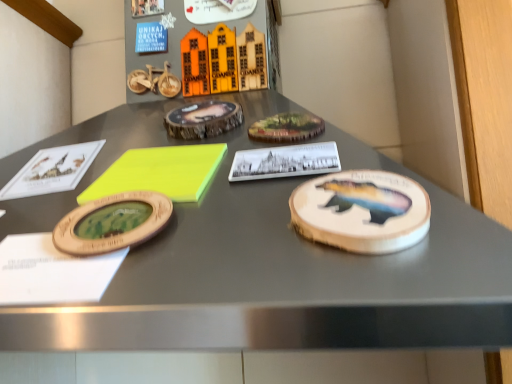
Question: Considering the positions of point (310, 180) and point (111, 168), is point (310, 180) closer or farther from the camera than point (111, 168)?

Choices:
 (A) closer
 (B) farther

Answer: (A)

Question: From a real-world perspective, is wooden coaster with bear design at right positioned above or below neon yellow foam at center?

Choices:
 (A) below
 (B) above

Answer: (A)

Question: Considering the positions of wooden coaster with bear design at right and neon yellow foam at center in the image, is wooden coaster with bear design at right wider or thinner than neon yellow foam at center?

Choices:
 (A) thin
 (B) wide

Answer: (A)

Question: Is neon yellow foam at center bigger or smaller than wooden coaster with bear design at right?

Choices:
 (A) small
 (B) big

Answer: (B)

Question: Is neon yellow foam at center taller or shorter than wooden coaster with bear design at right?

Choices:
 (A) tall
 (B) short

Answer: (A)

Question: From a real-world perspective, is neon yellow foam at center physically located above or below wooden coaster with bear design at right?

Choices:
 (A) above
 (B) below

Answer: (A)

Question: Looking at their shapes, would you say neon yellow foam at center is wider or thinner than wooden coaster with bear design at right?

Choices:
 (A) wide
 (B) thin

Answer: (A)